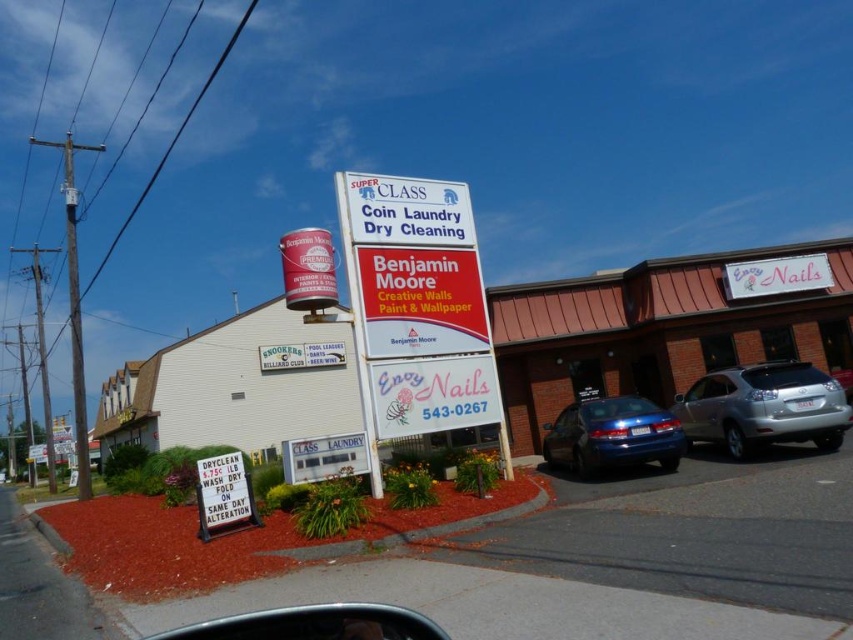
Looking at this image, between white plastic sign at upper center and white glossy sign at upper right, which one appears on the left side from the viewer's perspective?

Positioned to the left is white plastic sign at upper center.

Is white plastic sign at upper center to the right of white glossy sign at upper right from the viewer's perspective?

In fact, white plastic sign at upper center is to the left of white glossy sign at upper right.

This screenshot has width=853, height=640. What do you see at coordinates (407, 211) in the screenshot?
I see `white plastic sign at upper center` at bounding box center [407, 211].

Where is `white plastic sign at upper center`? The height and width of the screenshot is (640, 853). white plastic sign at upper center is located at coordinates 407,211.

Between silver metallic car at right and white glossy sign at upper right, which one has more height?

With more height is silver metallic car at right.

Is point (708, 401) positioned after point (779, 288)?

No, it is not.

Which is in front, point (706, 406) or point (785, 259)?

Point (706, 406) is more forward.

Where is `silver metallic car at right`? silver metallic car at right is located at coordinates (764, 406).

In the scene shown: Does red matte sign at center appear on the right side of white glossy sign at upper right?

Incorrect, red matte sign at center is not on the right side of white glossy sign at upper right.

Does red matte sign at center have a lesser height compared to white glossy sign at upper right?

No, red matte sign at center is not shorter than white glossy sign at upper right.

Does point (368, 291) come in front of point (743, 268)?

Yes, point (368, 291) is closer to viewer.

Find the location of a particular element. The height and width of the screenshot is (640, 853). red matte sign at center is located at coordinates (421, 301).